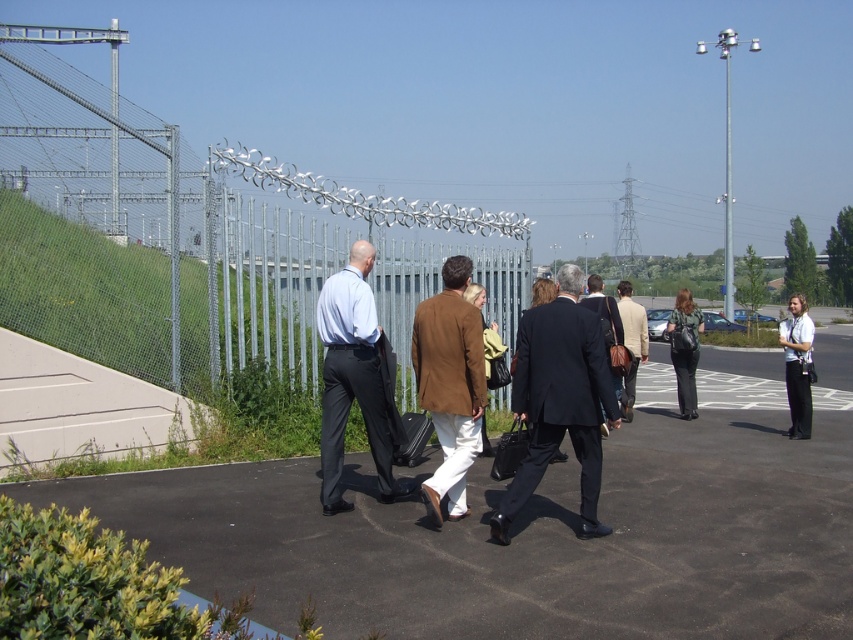
Question: Among these points, which one is nearest to the camera?

Choices:
 (A) (787, 364)
 (B) (274, 513)
 (C) (405, 339)
 (D) (672, 333)

Answer: (B)

Question: Which point is closer to the camera?

Choices:
 (A) (292, 580)
 (B) (607, 312)
 (C) (363, 317)

Answer: (A)

Question: Which of these objects is positioned farthest from the brown leather jacket at center?

Choices:
 (A) dark blue wool suit at center
 (B) metallic chain-link fence at upper left
 (C) white fabric camera at right

Answer: (C)

Question: Does black asphalt at center come behind metallic chain-link fence at upper left?

Choices:
 (A) no
 (B) yes

Answer: (A)

Question: Can you confirm if brown leather jacket at center is smaller than matte blue shirt at center?

Choices:
 (A) no
 (B) yes

Answer: (B)

Question: Can you confirm if metallic chain-link fence at upper left is positioned to the right of dark suit at center?

Choices:
 (A) yes
 (B) no

Answer: (B)